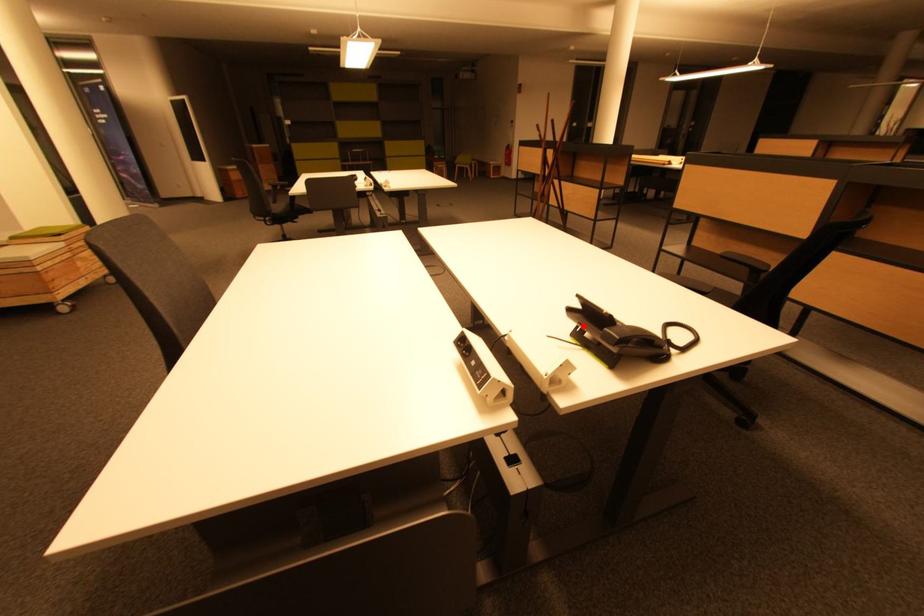
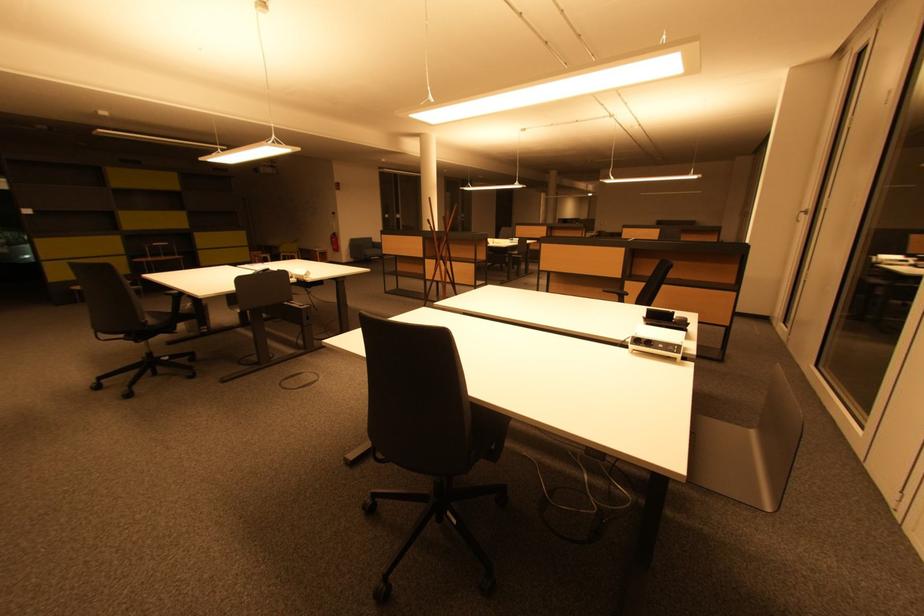
Where in the second image is the point corresponding to the highlighted location from the first image?

(661, 323)